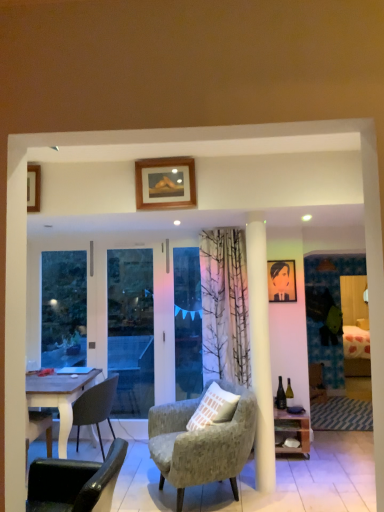
This screenshot has width=384, height=512. I want to click on vacant area on top of wooden picture frame at upper center, which is the second picture frame in bottom-to-top order (from a real-world perspective), so click(x=161, y=157).